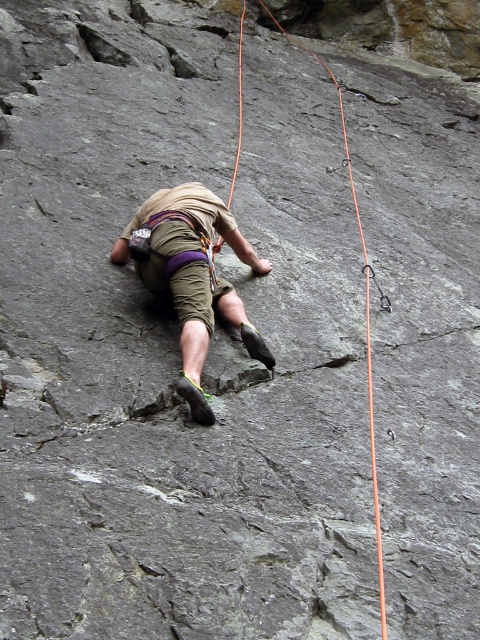
Question: Does khaki cotton shorts at center appear on the right side of orange nylon rope at upper center?

Choices:
 (A) no
 (B) yes

Answer: (A)

Question: Among these points, which one is nearest to the camera?

Choices:
 (A) (339, 113)
 (B) (194, 256)

Answer: (B)

Question: Can you confirm if khaki cotton shorts at center is positioned to the left of orange nylon rope at upper center?

Choices:
 (A) no
 (B) yes

Answer: (B)

Question: Is khaki cotton shorts at center below orange nylon rope at upper center?

Choices:
 (A) yes
 (B) no

Answer: (A)

Question: Which point is farther from the camera taking this photo?

Choices:
 (A) (268, 349)
 (B) (344, 124)

Answer: (B)